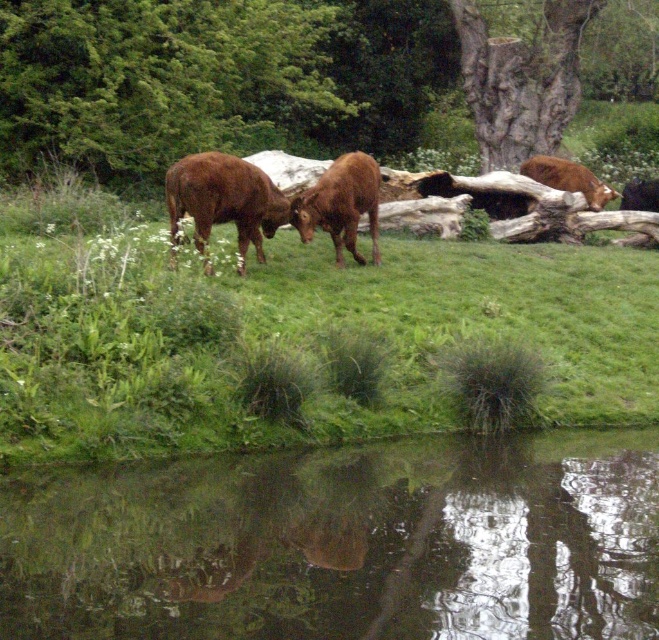
Question: Which point is closer to the camera taking this photo?

Choices:
 (A) (552, 179)
 (B) (478, 86)
 (C) (173, 202)
 (D) (556, 332)

Answer: (C)

Question: Which point is closer to the camera?

Choices:
 (A) (484, 138)
 (B) (140, 611)
 (C) (196, 244)

Answer: (B)

Question: Does green grassy at center have a larger size compared to brown furry bull at upper right?

Choices:
 (A) no
 (B) yes

Answer: (B)

Question: Where is brown smooth cow at center located in relation to brown matte cow at center in the image?

Choices:
 (A) above
 (B) below

Answer: (B)

Question: Can you confirm if brown matte cow at center is positioned below brown furry bull at upper right?

Choices:
 (A) no
 (B) yes

Answer: (B)

Question: Which point is closer to the camera?

Choices:
 (A) (538, 321)
 (B) (337, 204)
 (C) (627, 154)
 (D) (349, 545)

Answer: (D)